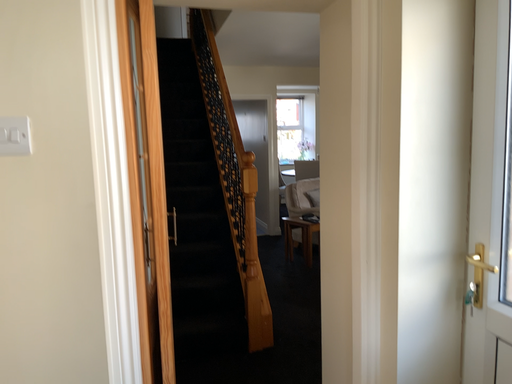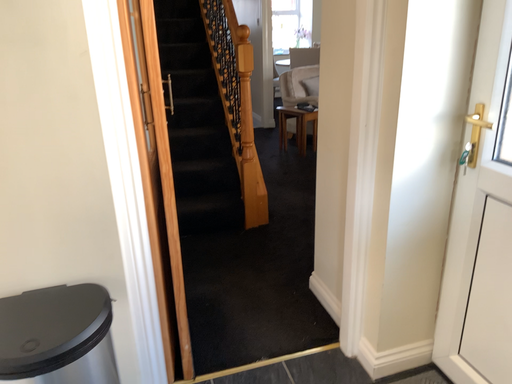
Question: How did the camera likely rotate when shooting the video?

Choices:
 (A) rotated downward
 (B) rotated upward

Answer: (A)